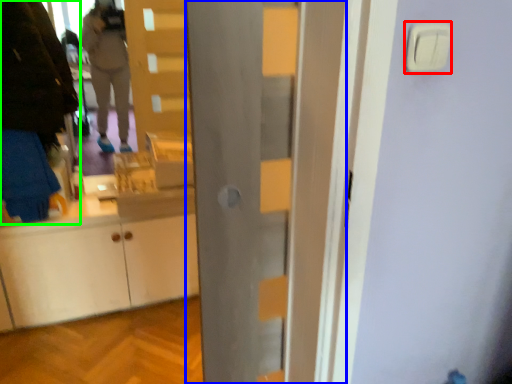
Question: Which is nearer to the light switch (highlighted by a red box)? door (highlighted by a blue box) or person (highlighted by a green box).

Choices:
 (A) door
 (B) person

Answer: (A)